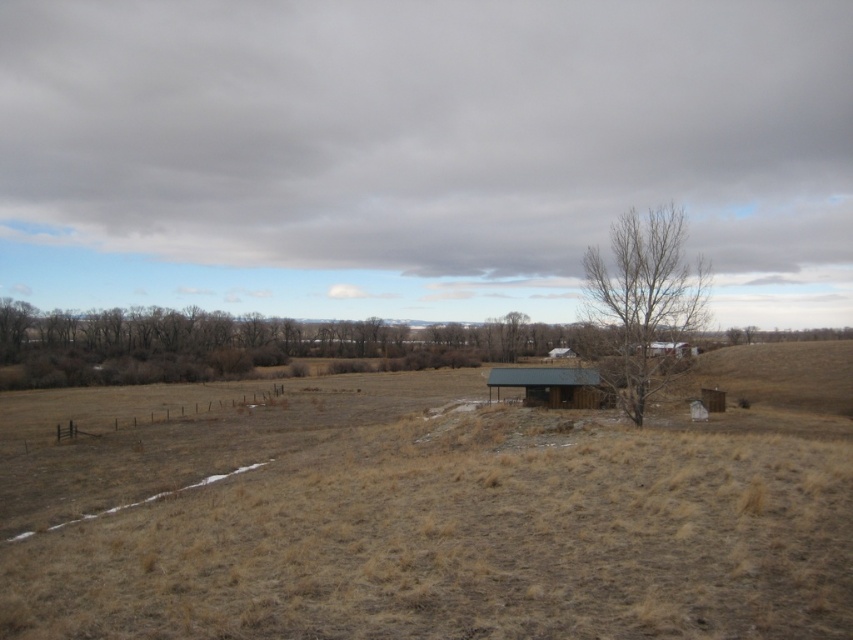
Question: Is bare wood tree at center wider than brown wooden cabin at center?

Choices:
 (A) yes
 (B) no

Answer: (A)

Question: Which of the following is the farthest from the observer?

Choices:
 (A) dry grass at center
 (B) brown wooden cabin at center

Answer: (B)

Question: Does dry grass at center have a larger size compared to brown wooden cabin at center?

Choices:
 (A) yes
 (B) no

Answer: (A)

Question: Does bare wood tree at center appear under brown wooden cabin at center?

Choices:
 (A) yes
 (B) no

Answer: (B)

Question: Which of the following is the closest to the observer?

Choices:
 (A) (537, 372)
 (B) (39, 506)
 (C) (653, 324)

Answer: (B)

Question: Which of the following is the closest to the observer?

Choices:
 (A) bare wood tree at center
 (B) brown wooden cabin at center

Answer: (A)